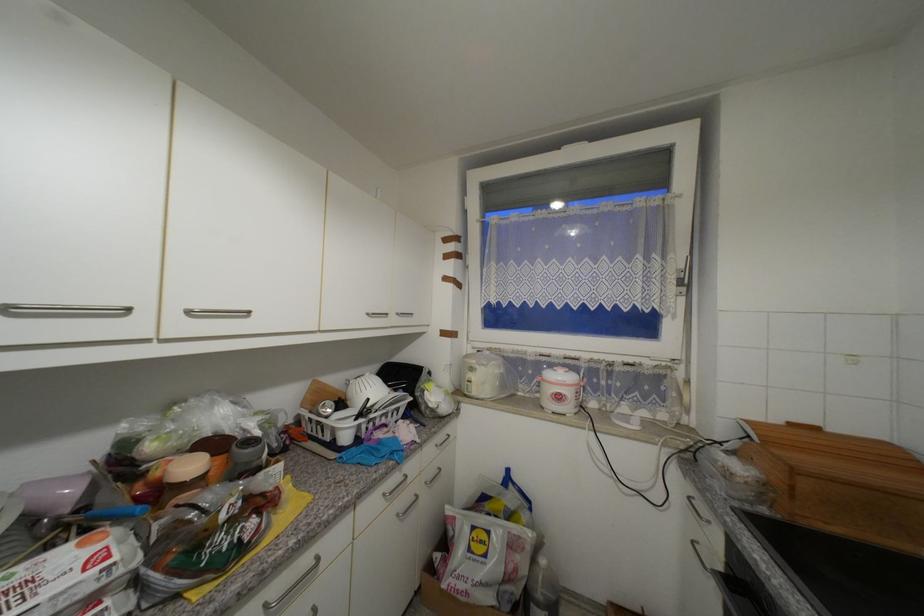
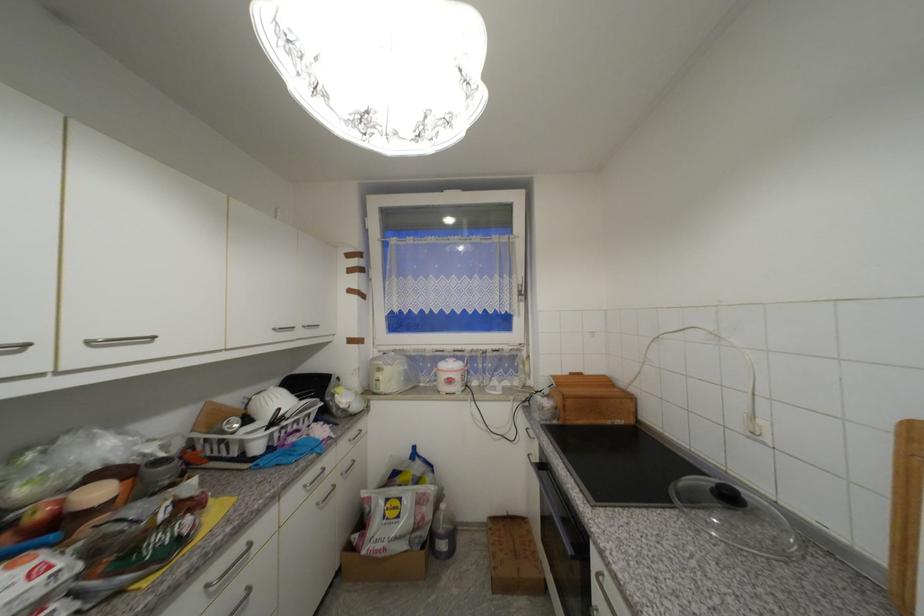
In the second image, find the point that corresponds to point (373, 315) in the first image.

(281, 331)